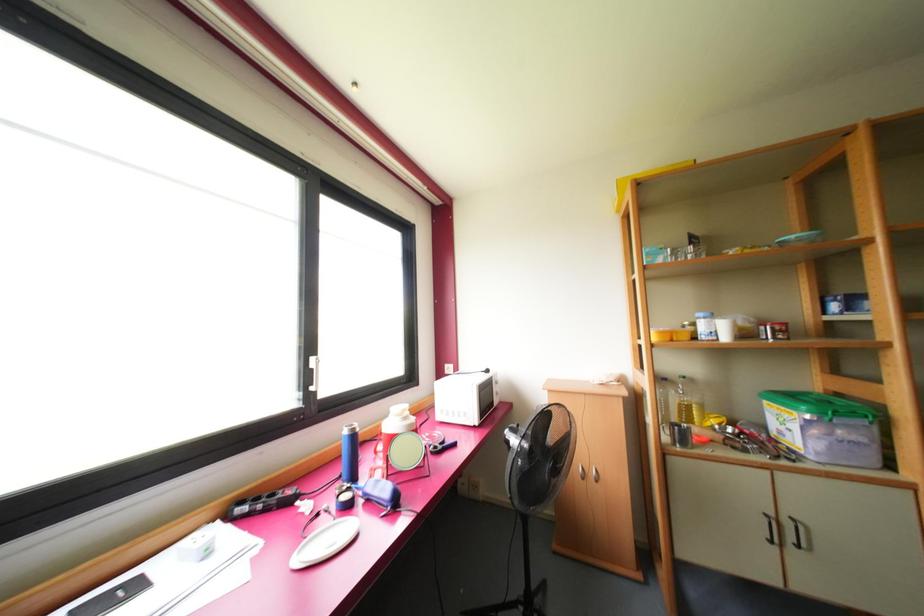
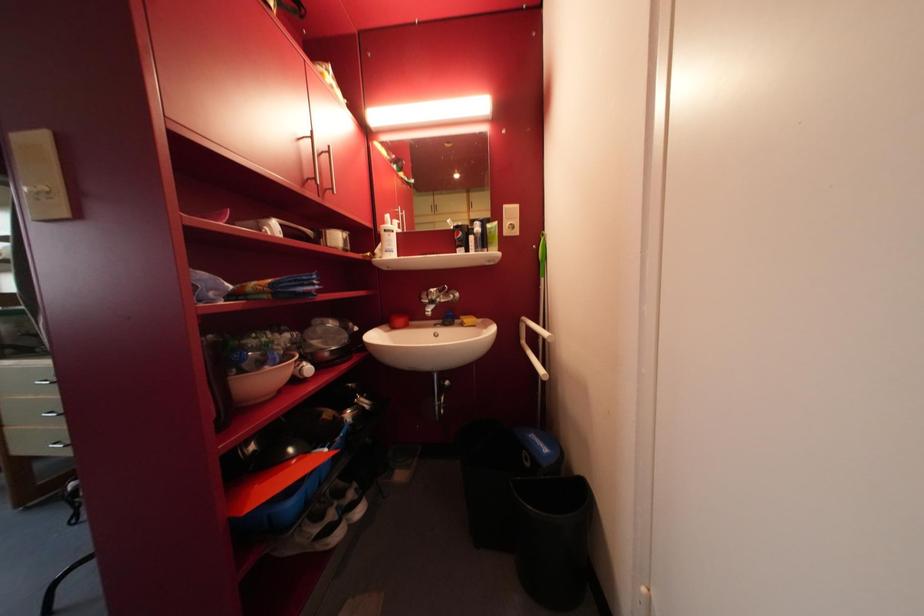
Question: What movement of the cameraman would produce the second image?

Choices:
 (A) Left
 (B) Right
 (C) Forward
 (D) Backward

Answer: (B)